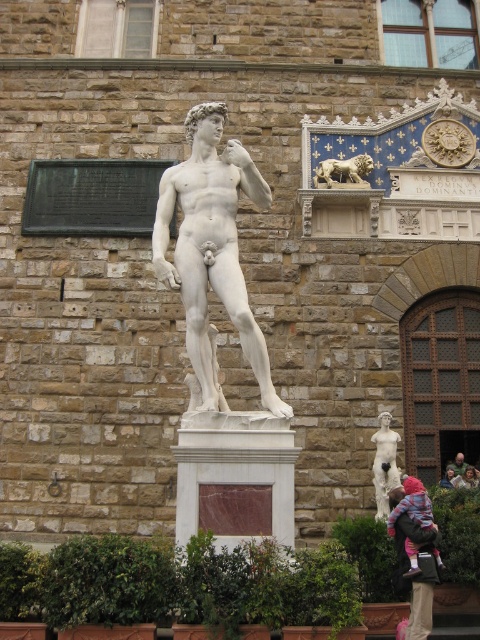
Who is positioned more to the left, white marble statue at lower right or brown hair at lower right?

white marble statue at lower right

The width and height of the screenshot is (480, 640). I want to click on white marble statue at lower right, so click(x=384, y=465).

Locate an element on the screen. The height and width of the screenshot is (640, 480). white marble statue at lower right is located at coordinates (384, 465).

Who is taller, white marble statue at lower right or gold metallic lion at upper center?

Standing taller between the two is white marble statue at lower right.

Is white marble statue at lower right to the right of gold metallic lion at upper center from the viewer's perspective?

Correct, you'll find white marble statue at lower right to the right of gold metallic lion at upper center.

Find the location of a particular element. The height and width of the screenshot is (640, 480). white marble statue at lower right is located at coordinates (384, 465).

Is white marble statue at center wider than gold metallic lion at upper center?

Yes.

Is white marble statue at center further to camera compared to gold metallic lion at upper center?

No.

Is point (170, 173) behind point (344, 166)?

No, it is in front of (344, 166).

This screenshot has height=640, width=480. Find the location of `white marble statue at center`. white marble statue at center is located at coordinates pyautogui.click(x=212, y=248).